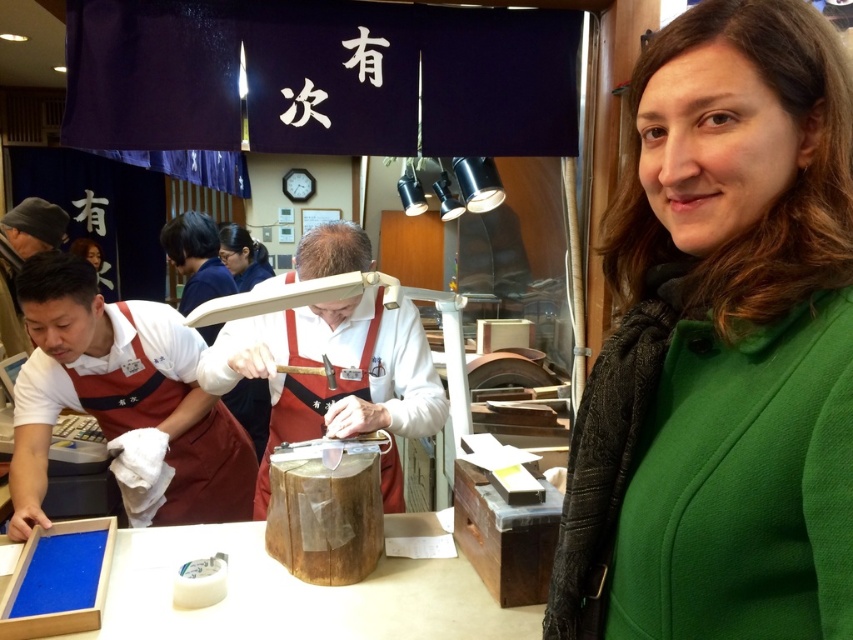
Does white cotton apron at left have a greater width compared to white leather gloves at center?

In fact, white cotton apron at left might be narrower than white leather gloves at center.

Does white cotton apron at left come in front of white leather gloves at center?

No, white cotton apron at left is further to the viewer.

You are a GUI agent. You are given a task and a screenshot of the screen. Output one action in this format:
    pyautogui.click(x=<x>, y=<y>)
    Task: Click on the white cotton apron at left
    This screenshot has width=853, height=640.
    Given the screenshot: What is the action you would take?
    pyautogui.click(x=120, y=394)

Locate an element on the screen. This screenshot has width=853, height=640. white cotton apron at left is located at coordinates coord(120,394).

Which of these two, green woolen coat at right or white leather gloves at center, stands taller?

white leather gloves at center is taller.

Who is more forward, (640,557) or (339,333)?

Positioned in front is point (640,557).

Describe the element at coordinates (722, 346) in the screenshot. I see `green woolen coat at right` at that location.

Find the location of a particular element. green woolen coat at right is located at coordinates (722, 346).

Is green woolen coat at right positioned in front of white cotton apron at left?

Yes, it is in front of white cotton apron at left.

Who is more forward, (813, 397) or (245, 506)?

Point (813, 397) is in front.

Where is `green woolen coat at right`? green woolen coat at right is located at coordinates (722, 346).